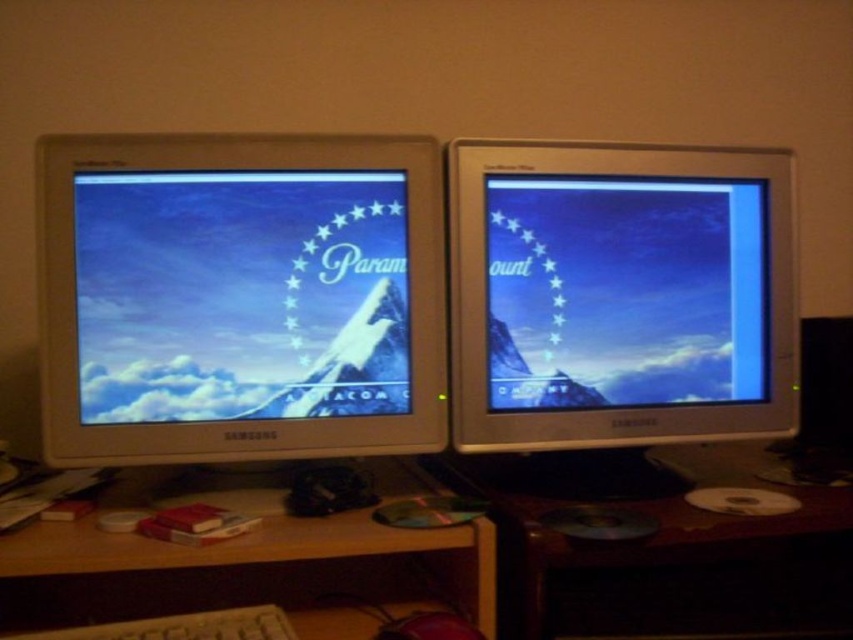
You are organizing items on a desk and need to place a small plant between the matte silver monitor at right and the wooden at lower left. Based on their positions, where should the plant be placed?

The matte silver monitor at right is above the wooden at lower left, so the plant should be placed between them by positioning it below the matte silver monitor at right and above the wooden at lower left to maintain spatial alignment.